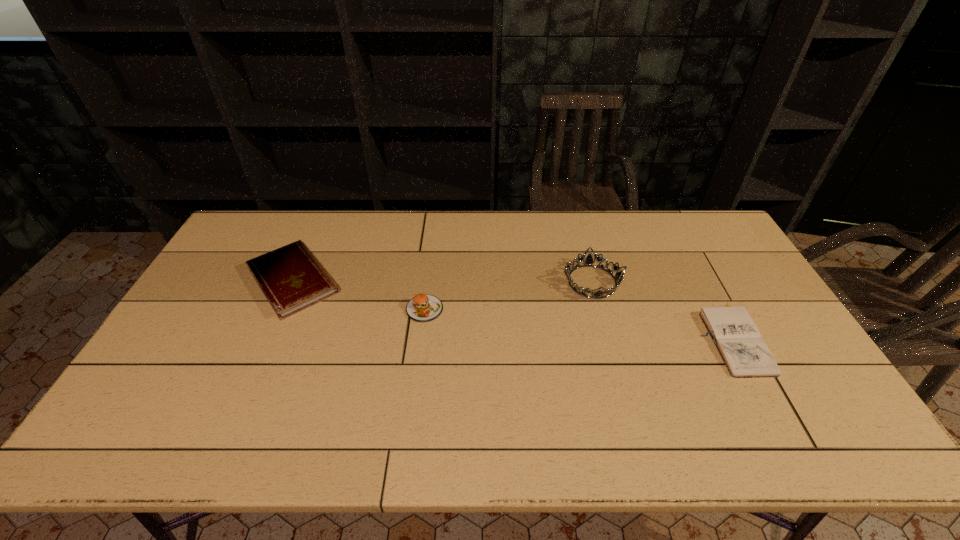
Image resolution: width=960 pixels, height=540 pixels. In order to click on free space between the rightmost object and the patty in this screenshot , I will do `click(578, 323)`.

Locate an element on the screen. free space between the patty and the tallest object is located at coordinates (508, 295).

The image size is (960, 540). What are the coordinates of `free space between the leftmost object and the second object from left to right` in the screenshot? It's located at (359, 294).

What are the coordinates of `vacant region between the rightmost object and the left notebook` in the screenshot? It's located at (513, 309).

Where is `blank region between the leftmost object and the tiara`? blank region between the leftmost object and the tiara is located at coordinates (443, 281).

Find the location of `vacant space that's between the rightmost object and the second tallest object`. vacant space that's between the rightmost object and the second tallest object is located at coordinates (578, 323).

At what (x,y) coordinates should I click in order to perform the action: click on blank region between the rightmost object and the tallest object. Please return your answer as a coordinate pair (x, y). The image size is (960, 540). Looking at the image, I should click on (662, 310).

Where is `free space between the second object from left to right and the tiara`? free space between the second object from left to right and the tiara is located at coordinates (508, 295).

This screenshot has width=960, height=540. In order to click on empty space that is in between the tiara and the right notebook in this screenshot , I will do `click(662, 310)`.

Identify the location of the third closest object to the left notebook. (746, 355).